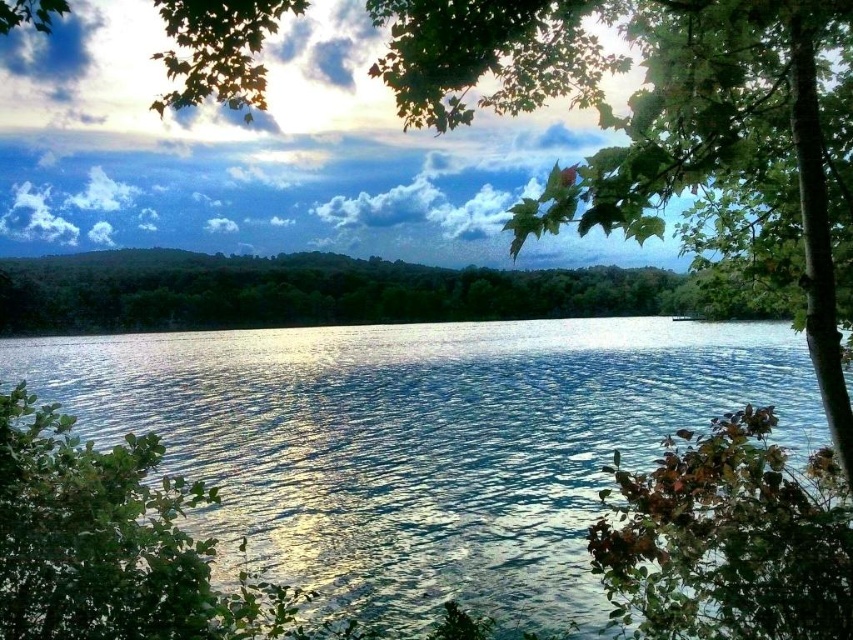
Can you confirm if glistening blue water at center is shorter than green leafy tree at lower left?

No, glistening blue water at center is not shorter than green leafy tree at lower left.

Between glistening blue water at center and green leafy tree at lower left, which one is positioned higher?

Positioned higher is glistening blue water at center.

The image size is (853, 640). In order to click on glistening blue water at center in this screenshot , I will do `click(422, 442)`.

Between glistening blue water at center and green leafy bush at lower right, which one appears on the left side from the viewer's perspective?

glistening blue water at center

Is point (503, 570) closer to camera compared to point (762, 458)?

No, (503, 570) is further to viewer.

The image size is (853, 640). In order to click on glistening blue water at center in this screenshot , I will do `click(422, 442)`.

Is green leafy bush at lower right thinner than green leafy tree at lower left?

Indeed, green leafy bush at lower right has a lesser width compared to green leafy tree at lower left.

Is point (819, 636) closer to viewer compared to point (45, 611)?

Yes, it is in front of point (45, 611).

You are a GUI agent. You are given a task and a screenshot of the screen. Output one action in this format:
    pyautogui.click(x=<x>, y=<y>)
    Task: Click on the green leafy bush at lower right
    Image resolution: width=853 pixels, height=640 pixels.
    Given the screenshot: What is the action you would take?
    pyautogui.click(x=729, y=540)

Identify the location of green leafy bush at lower right. This screenshot has height=640, width=853. (729, 540).